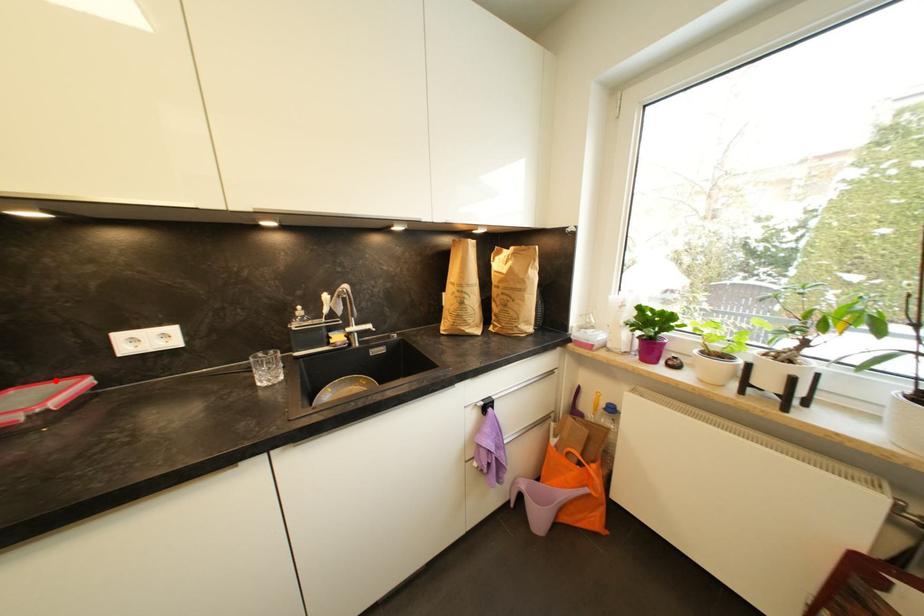
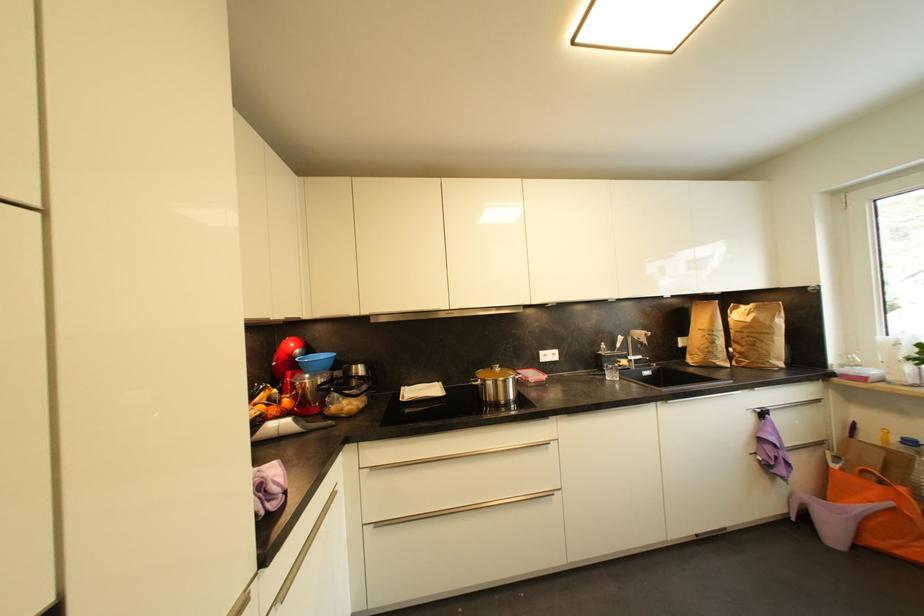
Where in the second image is the point corresponding to the highlighted location from the first image?

(528, 371)